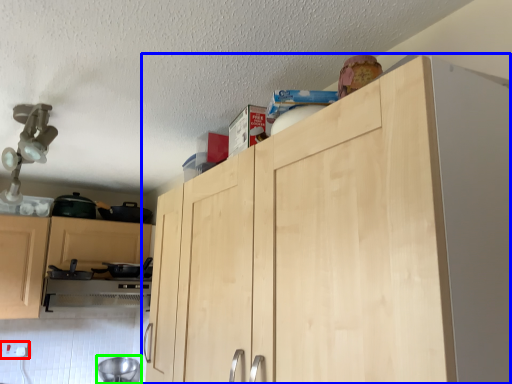
Question: Estimate the real-world distances between objects in this image. Which object is closer to electric outlet (highlighted by a red box), cupboard (highlighted by a blue box) or appliance (highlighted by a green box)?

Choices:
 (A) cupboard
 (B) appliance

Answer: (B)